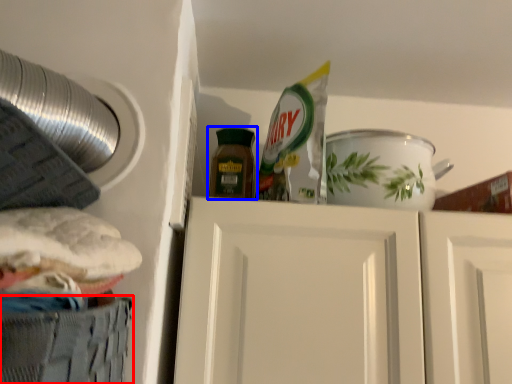
Question: Among these objects, which one is farthest to the camera, cabinetry (highlighted by a red box) or bottle (highlighted by a blue box)?

Choices:
 (A) cabinetry
 (B) bottle

Answer: (B)